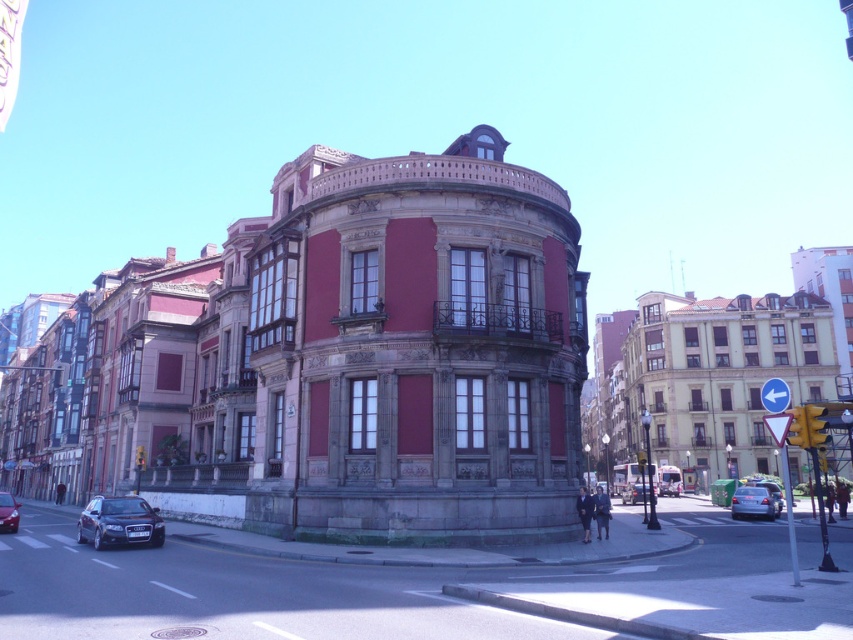
How distant is satin black car at lower left from metallic silver car at center?

satin black car at lower left is 42.61 meters from metallic silver car at center.

Is satin black car at lower left thinner than metallic silver car at center?

Incorrect, satin black car at lower left's width is not less than metallic silver car at center's.

Describe the element at coordinates (119, 522) in the screenshot. I see `satin black car at lower left` at that location.

The height and width of the screenshot is (640, 853). I want to click on satin black car at lower left, so click(x=119, y=522).

Which is below, shiny black sedan at lower left or metallic silver sedan at lower right?

metallic silver sedan at lower right

Is shiny black sedan at lower left above metallic silver sedan at lower right?

Yes, shiny black sedan at lower left is above metallic silver sedan at lower right.

Locate an element on the screen. shiny black sedan at lower left is located at coordinates (9, 513).

Locate an element on the screen. Image resolution: width=853 pixels, height=640 pixels. shiny black sedan at lower left is located at coordinates (9, 513).

Which is below, satin black car at lower left or metallic silver sedan at lower right?

metallic silver sedan at lower right is below.

Which is more to the right, satin black car at lower left or metallic silver sedan at lower right?

From the viewer's perspective, metallic silver sedan at lower right appears more on the right side.

Does point (109, 497) come closer to viewer compared to point (782, 502)?

That is True.

I want to click on satin black car at lower left, so click(x=119, y=522).